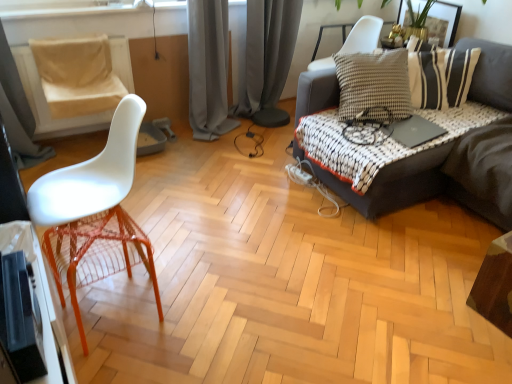
Question: From the image's perspective, is wooden table at lower right below beige fabric swivel chair at left?

Choices:
 (A) yes
 (B) no

Answer: (A)

Question: From a real-world perspective, is wooden table at lower right beneath beige fabric swivel chair at left?

Choices:
 (A) yes
 (B) no

Answer: (A)

Question: Is wooden table at lower right positioned in front of beige fabric swivel chair at left?

Choices:
 (A) yes
 (B) no

Answer: (A)

Question: Is wooden table at lower right smaller than beige fabric swivel chair at left?

Choices:
 (A) yes
 (B) no

Answer: (A)

Question: Is wooden table at lower right shorter than beige fabric swivel chair at left?

Choices:
 (A) no
 (B) yes

Answer: (B)

Question: Is there a large distance between wooden table at lower right and beige fabric swivel chair at left?

Choices:
 (A) no
 (B) yes

Answer: (B)

Question: Considering the relative sizes of gold metallic picture frame at upper right and dark gray fabric couch at right in the image provided, is gold metallic picture frame at upper right shorter than dark gray fabric couch at right?

Choices:
 (A) yes
 (B) no

Answer: (A)

Question: Is gold metallic picture frame at upper right next to dark gray fabric couch at right and touching it?

Choices:
 (A) no
 (B) yes

Answer: (A)

Question: Are gold metallic picture frame at upper right and dark gray fabric couch at right located far from each other?

Choices:
 (A) yes
 (B) no

Answer: (A)

Question: Is gold metallic picture frame at upper right located outside dark gray fabric couch at right?

Choices:
 (A) no
 (B) yes

Answer: (B)

Question: Is gold metallic picture frame at upper right oriented towards dark gray fabric couch at right?

Choices:
 (A) yes
 (B) no

Answer: (B)

Question: Is dark gray fabric couch at right located within gold metallic picture frame at upper right?

Choices:
 (A) yes
 (B) no

Answer: (B)

Question: From the image's perspective, would you say black matte laptop at upper right is positioned over beige fabric swivel chair at left?

Choices:
 (A) no
 (B) yes

Answer: (A)